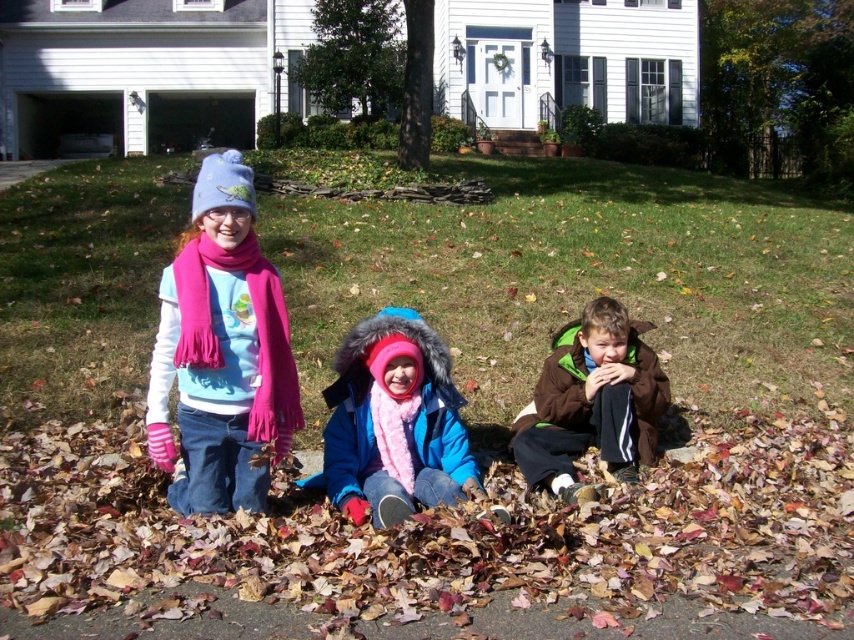
Does point (399, 349) come closer to viewer compared to point (583, 358)?

Yes, point (399, 349) is in front of point (583, 358).

Is blue fuzzy coat at center closer to camera compared to brown fleece jacket at lower right?

Yes, it is.

Does point (471, 461) come behind point (550, 445)?

No, (471, 461) is in front of (550, 445).

The width and height of the screenshot is (854, 640). In order to click on blue fuzzy coat at center in this screenshot , I will do `click(395, 422)`.

Is green grass at center above matte pink scarf at left?

Yes, green grass at center is above matte pink scarf at left.

Does green grass at center have a larger size compared to matte pink scarf at left?

Correct, green grass at center is larger in size than matte pink scarf at left.

Measure the distance between green grass at center and camera.

green grass at center is 20.54 feet from camera.

Image resolution: width=854 pixels, height=640 pixels. In order to click on green grass at center in this screenshot , I will do (x=581, y=278).

Does green grass at center have a greater height compared to blue fuzzy coat at center?

Yes.

Is the position of green grass at center more distant than that of blue fuzzy coat at center?

Yes, it is.

Identify the location of green grass at center. This screenshot has width=854, height=640. (581, 278).